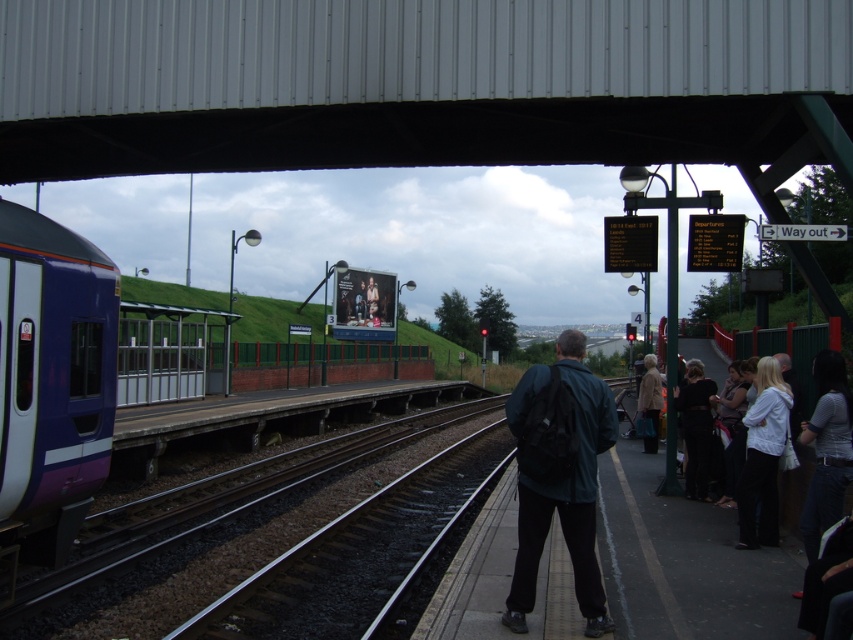
Question: Which object appears farthest from the camera in this image?

Choices:
 (A) light brown fabric coat at lower right
 (B) metallic gray overpass at upper center

Answer: (A)

Question: Among these points, which one is nearest to the camera?

Choices:
 (A) (531, 604)
 (B) (22, 480)
 (C) (654, 369)

Answer: (A)

Question: Which of the following is the farthest from the observer?

Choices:
 (A) pyautogui.click(x=474, y=406)
 (B) pyautogui.click(x=45, y=516)

Answer: (A)

Question: Is smooth metal track at center in front of dark green jacket at center?

Choices:
 (A) no
 (B) yes

Answer: (A)

Question: Is purple glossy train at left further to the viewer compared to white matte jacket at right?

Choices:
 (A) yes
 (B) no

Answer: (B)

Question: Does purple glossy train at left have a smaller size compared to smooth metal track at center?

Choices:
 (A) no
 (B) yes

Answer: (B)